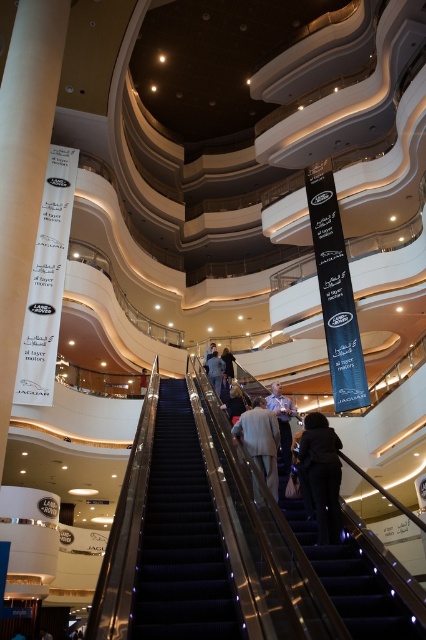
Does point (270, 410) come farther from viewer compared to point (232, 374)?

No, it is in front of (232, 374).

The width and height of the screenshot is (426, 640). Find the location of `light blue shirt at center`. light blue shirt at center is located at coordinates (282, 420).

Image resolution: width=426 pixels, height=640 pixels. What are the coordinates of `light blue shirt at center` in the screenshot? It's located at (282, 420).

Is point (192, 582) positioned in front of point (313, 444)?

That is True.

Is point (170, 637) behind point (308, 433)?

No, (170, 637) is closer to viewer.

Identify the location of black carpeted stairs at center. point(181,536).

Locate an element on the screen. black carpeted stairs at center is located at coordinates (181, 536).

Can you confirm if white paper banner at left is positioned to the left of light blue shirt at center?

Yes, white paper banner at left is to the left of light blue shirt at center.

Who is more distant from viewer, (51, 22) or (273, 394)?

The point (51, 22) is behind.

Where is `white paper banner at left`? The image size is (426, 640). white paper banner at left is located at coordinates (23, 168).